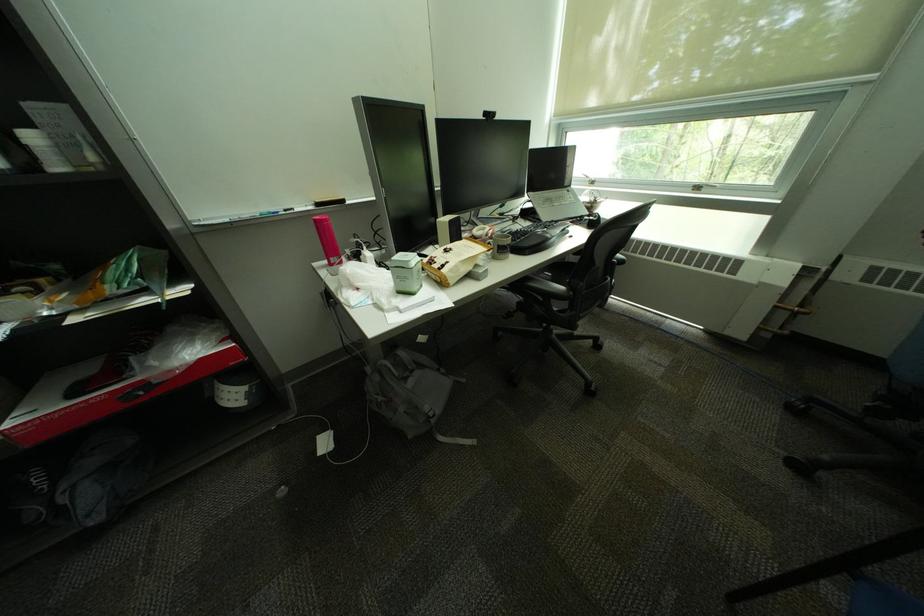
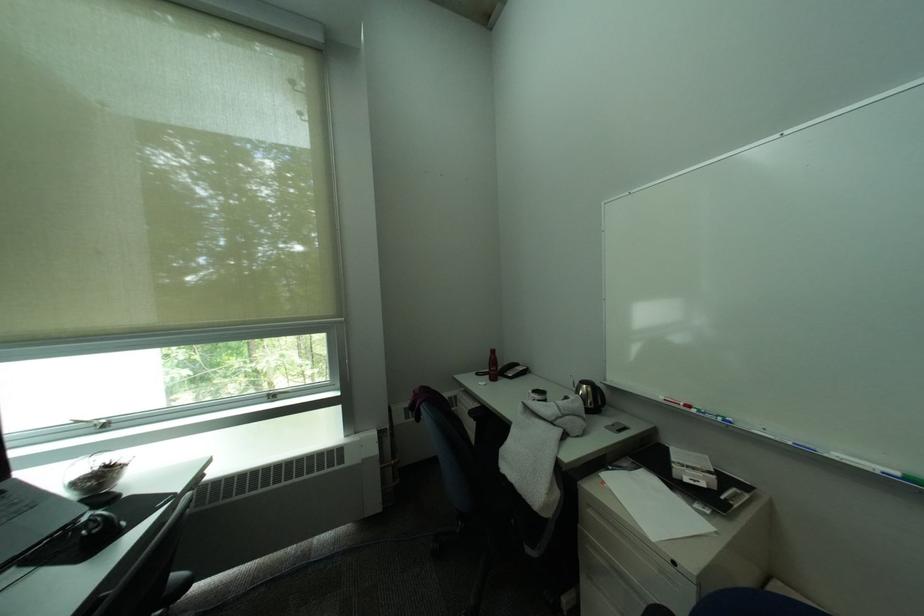
Question: The first image is from the beginning of the video and the second image is from the end. How did the camera likely rotate when shooting the video?

Choices:
 (A) Left
 (B) Right
 (C) Up
 (D) Down

Answer: (B)